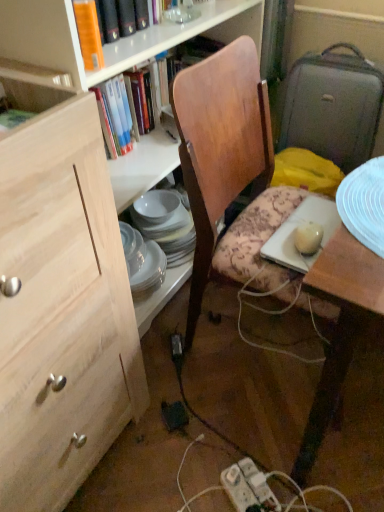
Question: Considering the relative positions of wooden chair at center and natural wood cabinet at left in the image provided, is wooden chair at center behind natural wood cabinet at left?

Choices:
 (A) yes
 (B) no

Answer: (A)

Question: From a real-world perspective, is wooden chair at center located beneath natural wood cabinet at left?

Choices:
 (A) no
 (B) yes

Answer: (B)

Question: Considering the relative sizes of wooden chair at center and natural wood cabinet at left in the image provided, is wooden chair at center wider than natural wood cabinet at left?

Choices:
 (A) yes
 (B) no

Answer: (B)

Question: Is wooden chair at center positioned with its back to natural wood cabinet at left?

Choices:
 (A) yes
 (B) no

Answer: (B)

Question: From the image's perspective, is wooden chair at center above natural wood cabinet at left?

Choices:
 (A) yes
 (B) no

Answer: (A)

Question: From a real-world perspective, is orange hardcover book at upper left, which ranks as the 1th book in back-to-front order, above or below gray fabric suitcase at right?

Choices:
 (A) above
 (B) below

Answer: (A)

Question: From the image's perspective, is orange hardcover book at upper left, marked as the third book in a bottom-to-top arrangement, located above or below gray fabric suitcase at right?

Choices:
 (A) above
 (B) below

Answer: (A)

Question: Considering the positions of orange hardcover book at upper left, the 1th book from the top, and gray fabric suitcase at right in the image, is orange hardcover book at upper left, the 1th book from the top, wider or thinner than gray fabric suitcase at right?

Choices:
 (A) wide
 (B) thin

Answer: (A)

Question: Based on their positions, is orange hardcover book at upper left, marked as the third book in a bottom-to-top arrangement, located to the left or right of gray fabric suitcase at right?

Choices:
 (A) right
 (B) left

Answer: (B)

Question: Is black plastic power plugs and sockets at lower center wider or thinner than orange hardcover book at upper left, the 1th book from the top?

Choices:
 (A) thin
 (B) wide

Answer: (A)

Question: From the image's perspective, is black plastic power plugs and sockets at lower center positioned above or below orange hardcover book at upper left, the 3th book when ordered from front to back?

Choices:
 (A) above
 (B) below

Answer: (B)

Question: Do you think black plastic power plugs and sockets at lower center is within orange hardcover book at upper left, the 3th book when ordered from front to back, or outside of it?

Choices:
 (A) inside
 (B) outside

Answer: (B)

Question: Is black plastic power plugs and sockets at lower center taller or shorter than orange hardcover book at upper left, which ranks as the 1th book in back-to-front order?

Choices:
 (A) short
 (B) tall

Answer: (A)

Question: In terms of size, does gray fabric suitcase at right appear bigger or smaller than green matte book at upper left, which is the 3th book from top to bottom?

Choices:
 (A) big
 (B) small

Answer: (A)

Question: Choose the correct answer: Is gray fabric suitcase at right inside green matte book at upper left, which is counted as the first book, starting from the front, or outside it?

Choices:
 (A) inside
 (B) outside

Answer: (B)